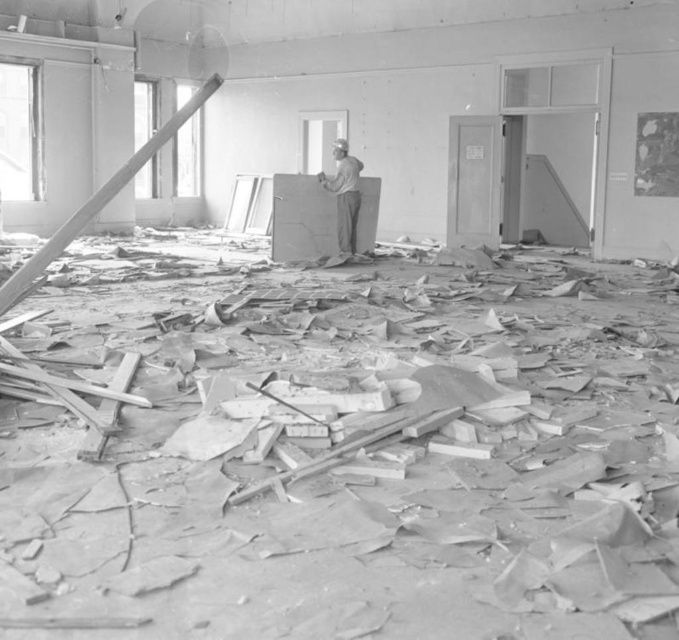
Based on the photo, who is positioned more to the left, crumbly concrete debris at center or gray fabric cap at center?

crumbly concrete debris at center is more to the left.

Between crumbly concrete debris at center and gray fabric cap at center, which one appears on the right side from the viewer's perspective?

Positioned to the right is gray fabric cap at center.

At what (x,y) coordinates should I click in order to perform the action: click on crumbly concrete debris at center. Please return your answer as a coordinate pair (x, y). This screenshot has height=640, width=679. Looking at the image, I should click on (348, 460).